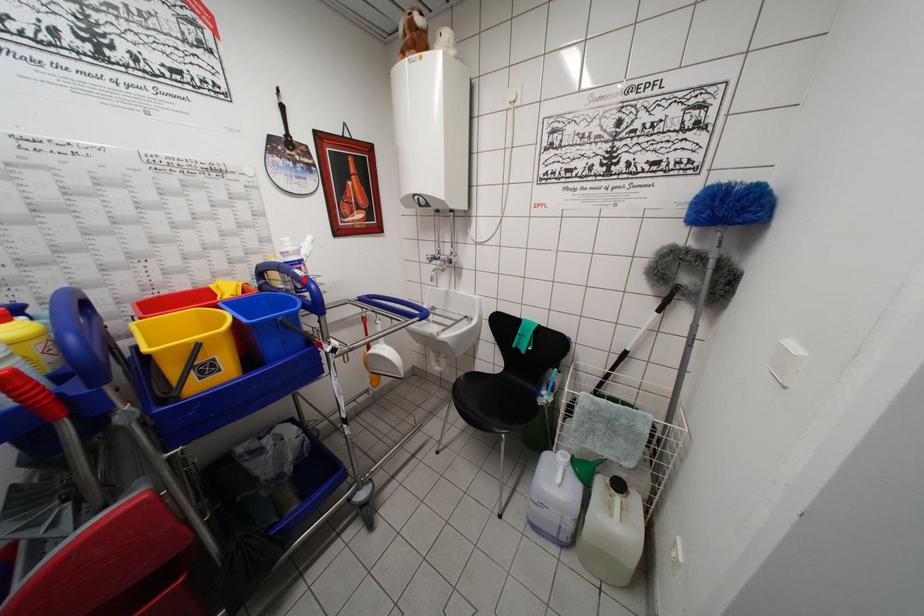
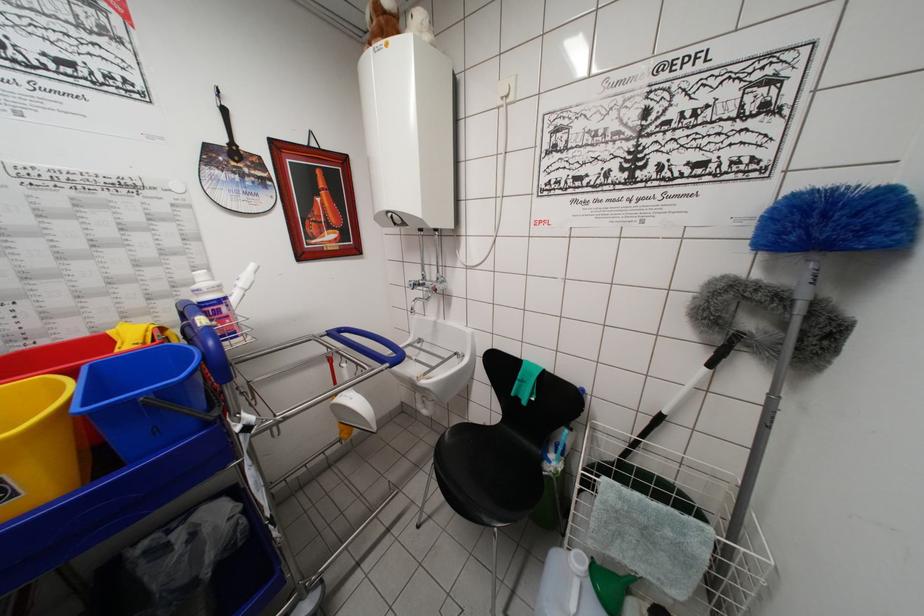
Question: I am providing you with two images of the same scene from different viewpoints. Image1 has a red point marked. In image2, the corresponding 3D location appears at what relative position? Reply with the corresponding letter.

Choices:
 (A) Closer
 (B) Farther

Answer: (B)